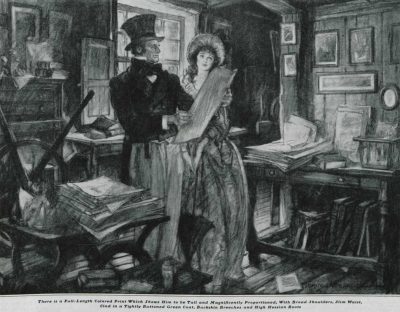
Find the location of a particular element. wooden floor is located at coordinates (258, 273).